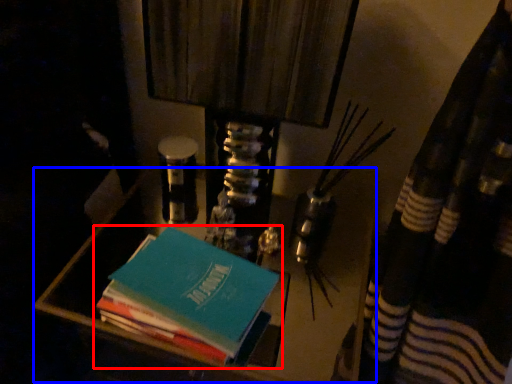
Question: Which object appears farthest to the camera in this image, book (highlighted by a red box) or vanity (highlighted by a blue box)?

Choices:
 (A) book
 (B) vanity

Answer: (B)